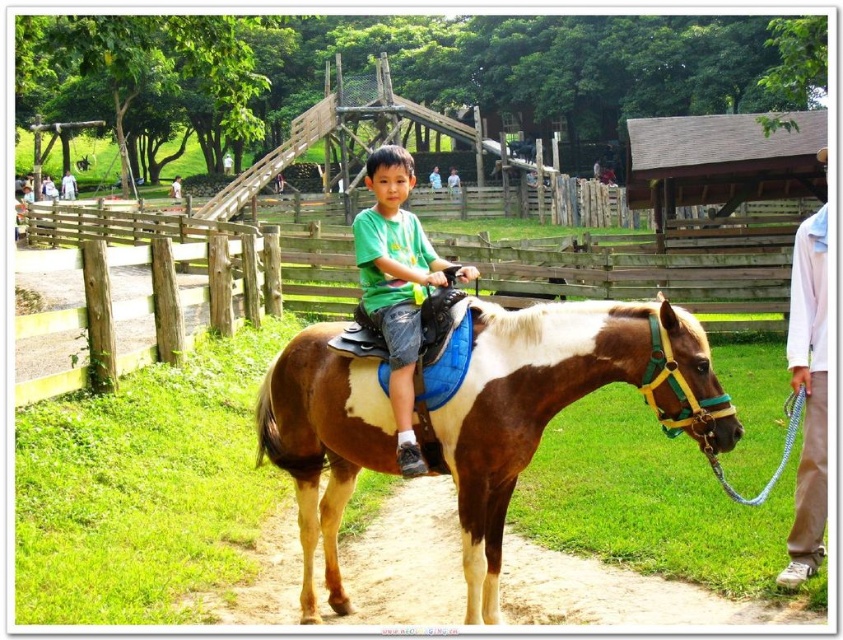
Does wooden fence at center have a greater height compared to white shirt at right?

Indeed, wooden fence at center has a greater height compared to white shirt at right.

Between point (766, 250) and point (820, 371), which one is positioned behind?

The point (766, 250) is behind.

The height and width of the screenshot is (640, 843). In order to click on wooden fence at center in this screenshot , I will do `click(636, 266)`.

Can you confirm if brown glossy horse at center is positioned to the left of brown leather path at lower center?

No, brown glossy horse at center is not to the left of brown leather path at lower center.

Describe the element at coordinates (560, 403) in the screenshot. I see `brown glossy horse at center` at that location.

Which is behind, point (502, 499) or point (395, 620)?

Point (395, 620)

The height and width of the screenshot is (640, 843). Identify the location of brown glossy horse at center. [560, 403].

Can you confirm if brown glossy horse at center is positioned to the left of green matte shirt at center?

Incorrect, brown glossy horse at center is not on the left side of green matte shirt at center.

Between point (540, 381) and point (390, 390), which one is positioned in front?

Positioned in front is point (540, 381).

Locate an element on the screen. brown glossy horse at center is located at coordinates (560, 403).